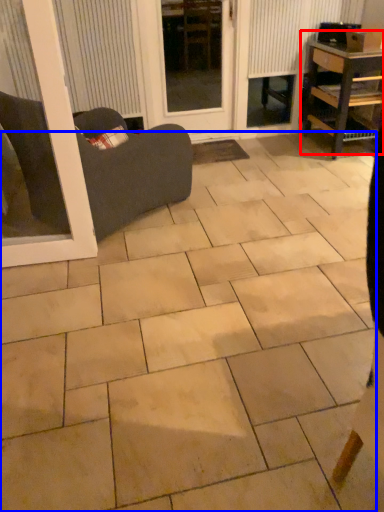
Question: Which of the following is the closest to the observer, table (highlighted by a red box) or ceramic tile (highlighted by a blue box)?

Choices:
 (A) table
 (B) ceramic tile

Answer: (B)